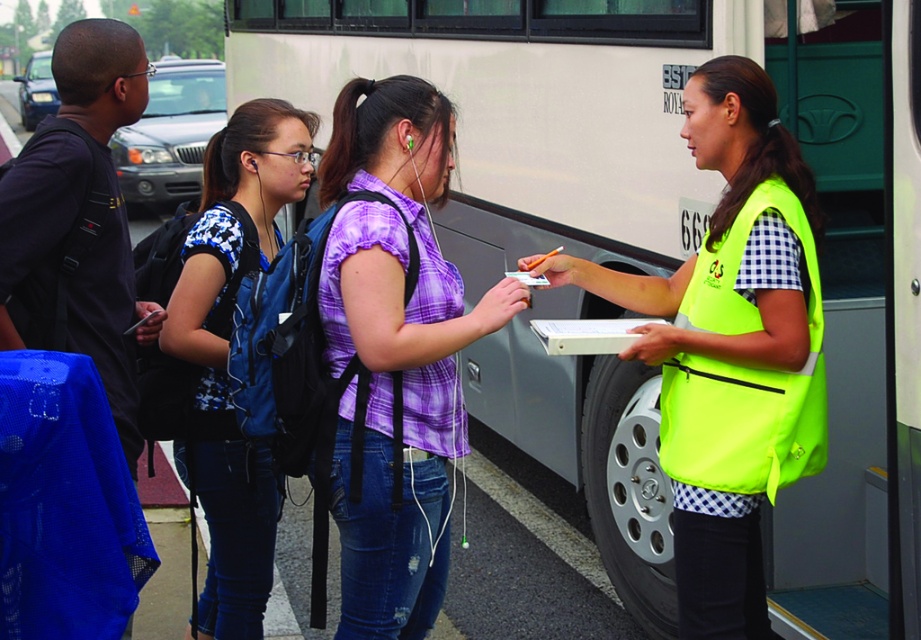
You are standing in front of the bus and notice two people wearing shirts with different patterns. The purple plaid shirt at center and the blue printed shirt at center. Which shirt is positioned to the right of the other?

The purple plaid shirt at center is to the right of the blue printed shirt at center.

Based on the scene description, where is the purple plaid shirt at center positioned relative to the bus?

The purple plaid shirt at center is located at point 0.548 on the x axis and 0.430 on the y axis relative to the bus.